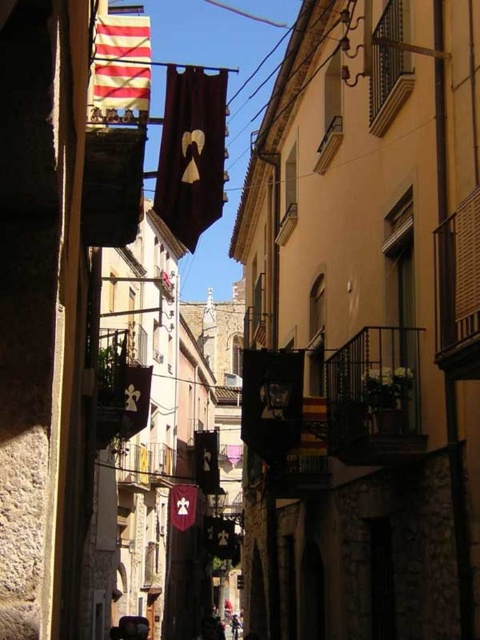
Question: Does striped fabric flag at upper left have a larger size compared to maroon velvet flag at center?

Choices:
 (A) no
 (B) yes

Answer: (B)

Question: Is dark brown fabric flag at center further to the viewer compared to striped fabric flag at upper left?

Choices:
 (A) yes
 (B) no

Answer: (A)

Question: Does dark brown fabric flag at center appear under striped fabric flag at upper left?

Choices:
 (A) yes
 (B) no

Answer: (A)

Question: Which point appears farthest from the camera in this image?

Choices:
 (A) (136, 104)
 (B) (168, 499)

Answer: (B)

Question: Which object is closer to the camera taking this photo?

Choices:
 (A) striped fabric flag at upper left
 (B) dark brown fabric flag at center
 (C) maroon velvet flag at center

Answer: (A)

Question: Which of these objects is positioned farthest from the striped fabric flag at upper left?

Choices:
 (A) dark brown fabric flag at center
 (B) maroon velvet flag at center

Answer: (B)